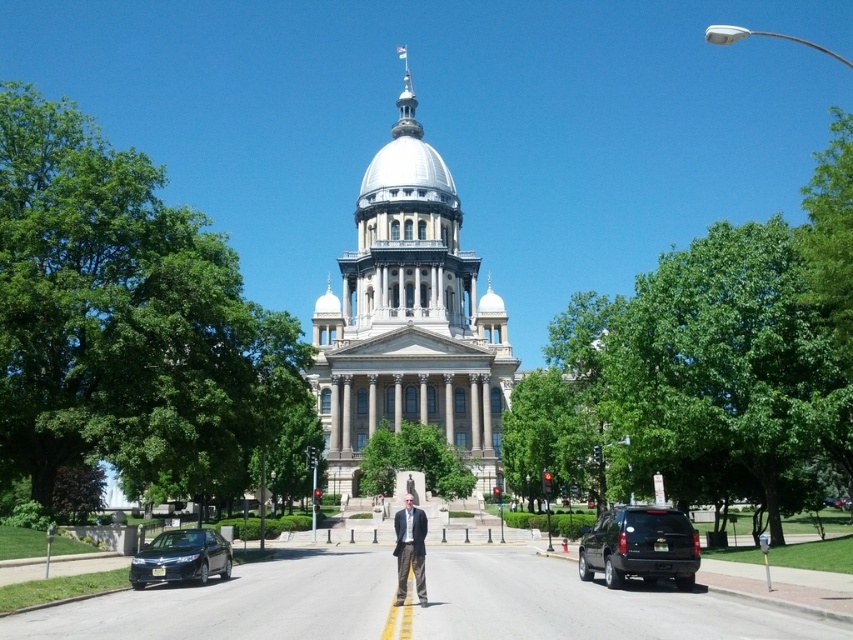
Can you confirm if black matte suv at lower right is positioned to the left of light brown textured pants at center?

Incorrect, black matte suv at lower right is not on the left side of light brown textured pants at center.

Who is higher up, black matte suv at lower right or light brown textured pants at center?

light brown textured pants at center

I want to click on black matte suv at lower right, so click(x=639, y=547).

Which of these two, shiny black sedan at lower left or light brown textured pants at center, stands shorter?

With less height is shiny black sedan at lower left.

Describe the element at coordinates (181, 557) in the screenshot. I see `shiny black sedan at lower left` at that location.

Locate an element on the screen. shiny black sedan at lower left is located at coordinates (181, 557).

Which of these two, black matte suv at lower right or shiny black sedan at lower left, stands shorter?

With less height is shiny black sedan at lower left.

In order to click on black matte suv at lower right in this screenshot , I will do `click(639, 547)`.